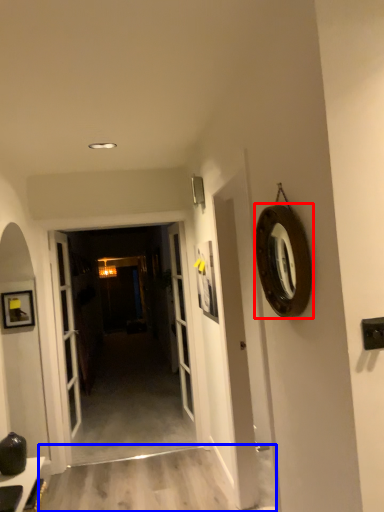
Question: Which object is further to the camera taking this photo, oval (highlighted by a red box) or path (highlighted by a blue box)?

Choices:
 (A) oval
 (B) path

Answer: (B)